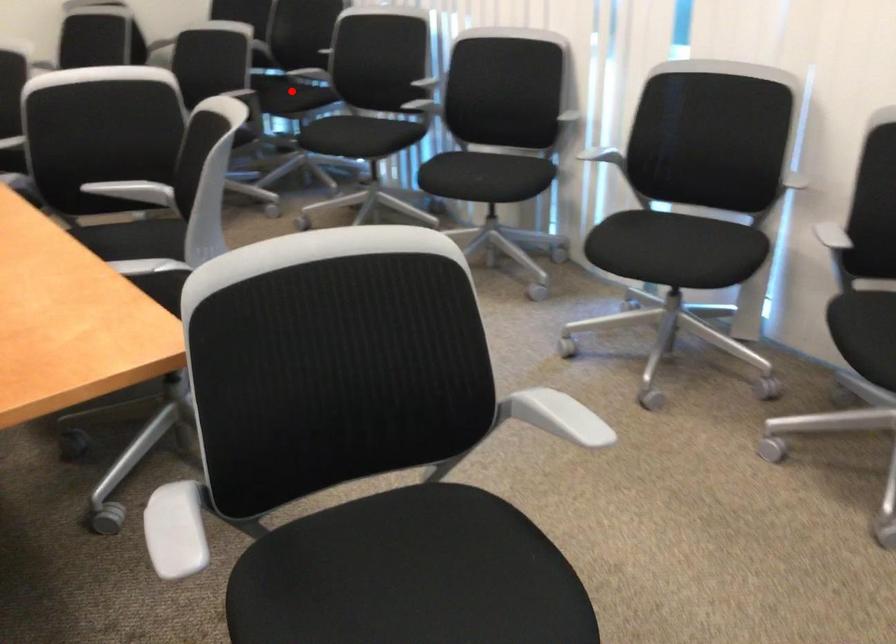
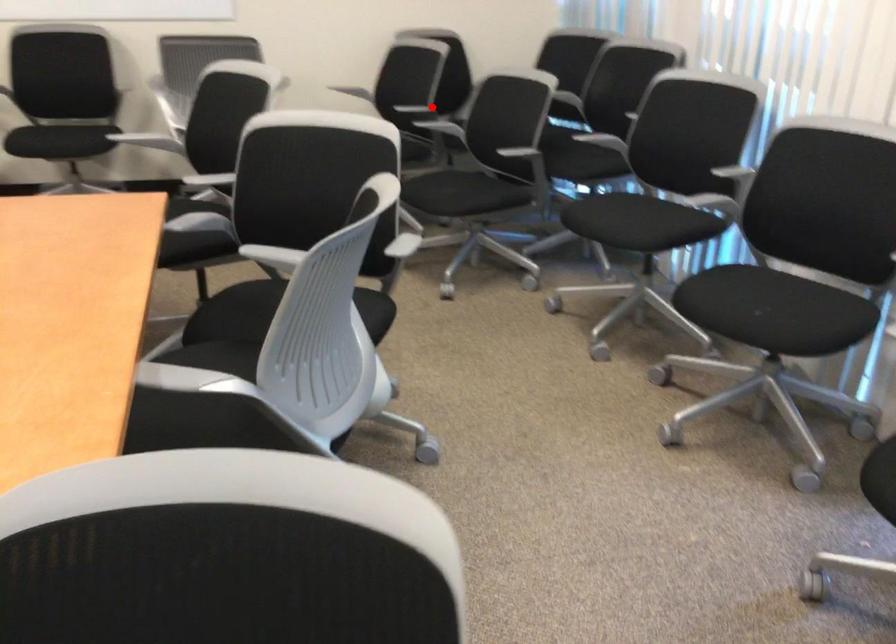
I am providing you with two images of the same scene from different viewpoints. A red point is marked on the first image and another point is marked on the second image. Is the red point in image1 aligned with the point shown in image2?

No